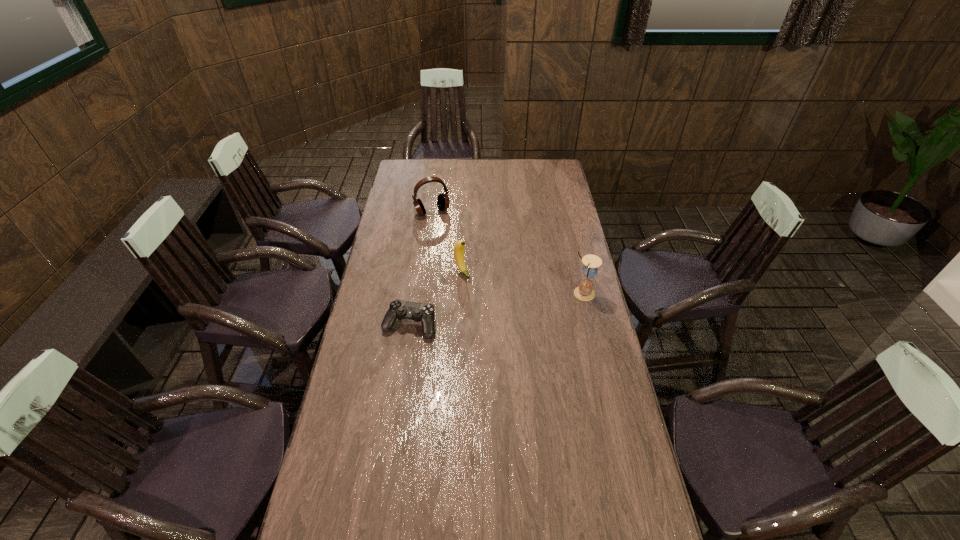
You are a GUI agent. You are given a task and a screenshot of the screen. Output one action in this format:
    pyautogui.click(x=<x>, y=<y>)
    Task: Click on the free point located from the stem of the second object from right to left
    
    Given the screenshot: What is the action you would take?
    pyautogui.click(x=492, y=307)

Locate an element on the screen. The width and height of the screenshot is (960, 540). vacant space located from the stem of the second object from right to left is located at coordinates (490, 304).

Locate an element on the screen. free space located 0.270m on the ear pads of the headset is located at coordinates (457, 253).

Image resolution: width=960 pixels, height=540 pixels. Find the location of `vacant space located 0.370m on the ear pads of the headset`. vacant space located 0.370m on the ear pads of the headset is located at coordinates (466, 267).

The width and height of the screenshot is (960, 540). I want to click on vacant space located 0.050m on the ear pads of the headset, so click(442, 225).

At what (x,y) coordinates should I click in order to perform the action: click on control that is at the left edge. Please return your answer as a coordinate pair (x, y). The height and width of the screenshot is (540, 960). Looking at the image, I should click on (425, 313).

You are a GUI agent. You are given a task and a screenshot of the screen. Output one action in this format:
    pyautogui.click(x=<x>, y=<y>)
    Task: Click on the headset that is at the left edge
    The height and width of the screenshot is (540, 960).
    Given the screenshot: What is the action you would take?
    pyautogui.click(x=443, y=202)

At what (x,y) coordinates should I click in order to perform the action: click on object that is at the right edge. Please return your answer as a coordinate pair (x, y). The width and height of the screenshot is (960, 540). Looking at the image, I should click on (584, 291).

Find the location of a particular element. Image resolution: width=960 pixels, height=540 pixels. vacant space at the far edge of the desktop is located at coordinates (430, 167).

I want to click on free space at the left edge of the desktop, so click(412, 208).